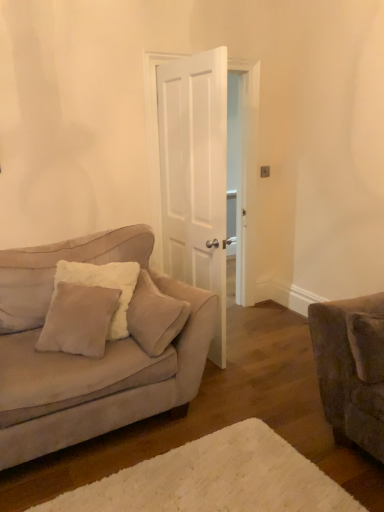
Question: Is white matte door at center situated inside white fluffy rug at lower center or outside?

Choices:
 (A) outside
 (B) inside

Answer: (A)

Question: Is white matte door at center to the left or to the right of white fluffy rug at lower center in the image?

Choices:
 (A) right
 (B) left

Answer: (A)

Question: Which is farther from the white fluffy rug at lower center?

Choices:
 (A) white matte door at center
 (B) suede couch at left
 (C) beige plush pillow at left, which is the 2th pillow from left to right
 (D) beige plush pillow at left, the 3th pillow from the right
 (E) suede-like beige pillow at lower right, the 3th pillow viewed from the left

Answer: (A)

Question: Based on their relative distances, which object is nearer to the beige plush pillow at left, marked as the second pillow in a right-to-left arrangement?

Choices:
 (A) suede-like beige pillow at lower right, which is counted as the first pillow, starting from the right
 (B) beige plush pillow at left, the 3th pillow from the right
 (C) suede couch at left
 (D) white matte door at center
 (E) white fluffy rug at lower center

Answer: (C)